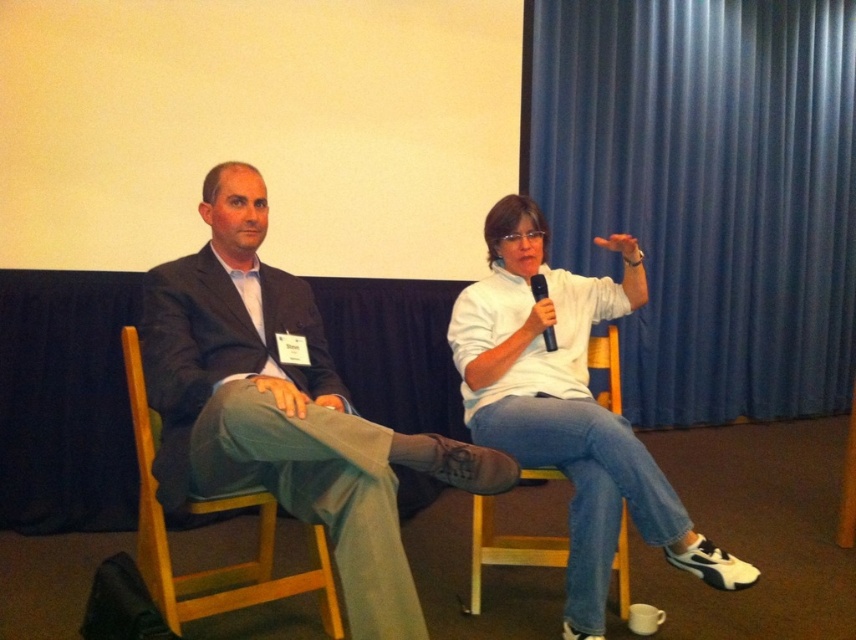
From the picture: You are a photographer who needs to adjust the focus of your camera to capture a clear image of the white matte shirt at center. What is the minimum distance you should set your camera focus to ensure the shirt is in focus?

The white matte shirt at center is positioned 1.82 meters away from the camera, so you should set the focus distance to at least 1.82 meters to ensure it is in clear focus.

You are organizing a photo shoot and need to arrange the two subjects so that the shorter one is in front to avoid blocking the view. Given the current setup with the matte black suit at left and the white matte shirt at center, which one should be moved forward?

The matte black suit at left should be moved forward since it has a lesser height compared to the white matte shirt at center, ensuring the shorter subject is in front.

You are organizing a small event and need to decide whether the white matte shirt at center can be placed on top of the wooden chair at left without falling off. Based on their sizes, what should you consider?

The white matte shirt at center has a greater height compared to the wooden chair at left, so placing it on top might cause instability and could result in it falling off due to its height exceeding the chair.